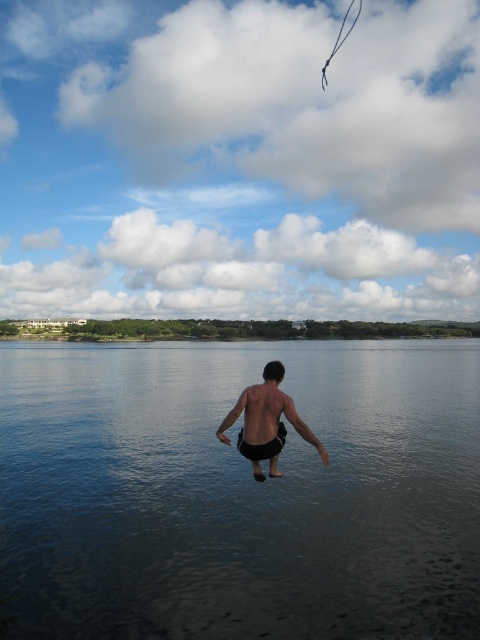
Which is behind, point (121, 520) or point (283, 369)?

Positioned behind is point (121, 520).

Measure the distance between point (x=457, y=576) and camera.

The distance of point (x=457, y=576) from camera is 27.46 feet.

Is point (442, 412) more distant than point (244, 396)?

That is True.

Where is `dark blue water at center`? The image size is (480, 640). dark blue water at center is located at coordinates (239, 492).